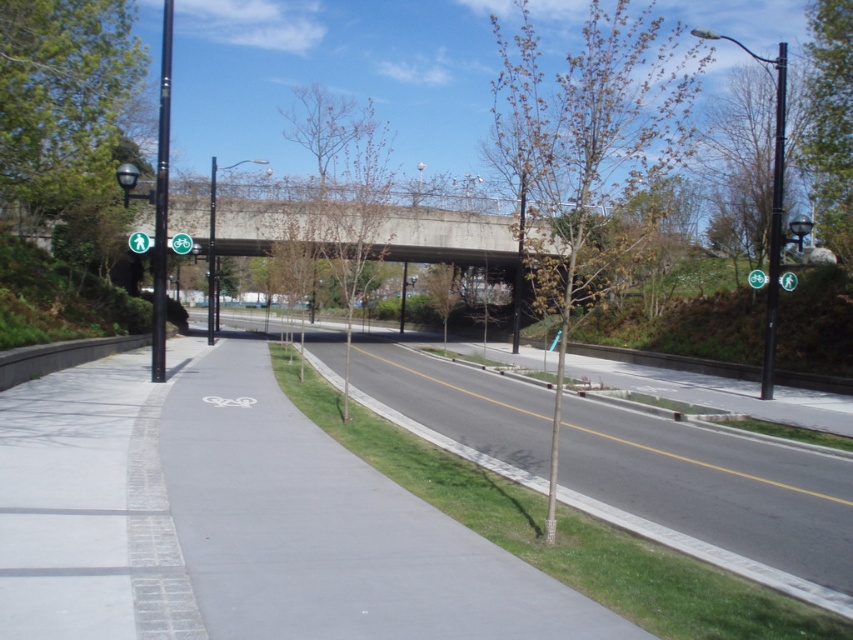
Question: Which is nearer to the asphalt road at center?

Choices:
 (A) green plastic bicycle at center
 (B) black metal pole at center

Answer: (A)

Question: Which of the following is the closest to the observer?

Choices:
 (A) (190, 241)
 (B) (531, 236)
 (C) (773, 228)

Answer: (A)

Question: Which of the following is the closest to the observer?

Choices:
 (A) (175, 246)
 (B) (750, 280)

Answer: (A)

Question: Is black metal pole at right smaller than metallic pole at center?

Choices:
 (A) no
 (B) yes

Answer: (B)

Question: Does green plastic pedestrian sign at upper left come in front of green plastic bicycle at center?

Choices:
 (A) yes
 (B) no

Answer: (A)

Question: Is asphalt road at center bigger than metallic pole at center?

Choices:
 (A) no
 (B) yes

Answer: (A)